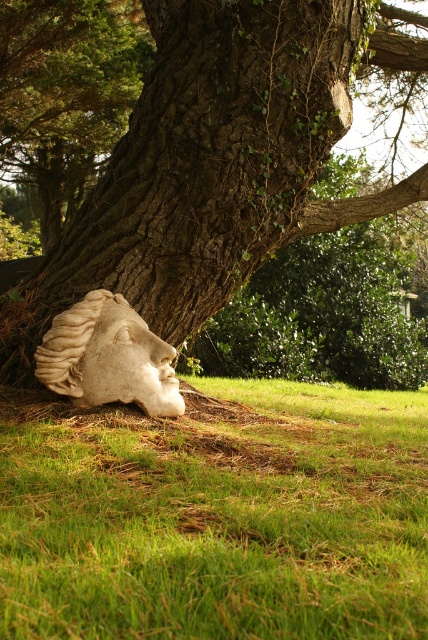
You are standing in the garden looking at the green grass at lower center and the white stone head at lower left. Which object is nearer to you?

The green grass at lower center is closer to the viewer than the white stone head at lower left.

You are a gardener who needs to place a new decorative rock that is 0.5 meters wide between the green grass at lower center and the white stone head at lower left. Can you fit it there?

The distance between the green grass at lower center and the white stone head at lower left is 1.31 meters. Since the decorative rock is only 0.5 meters wide, there is enough space to place it between them.